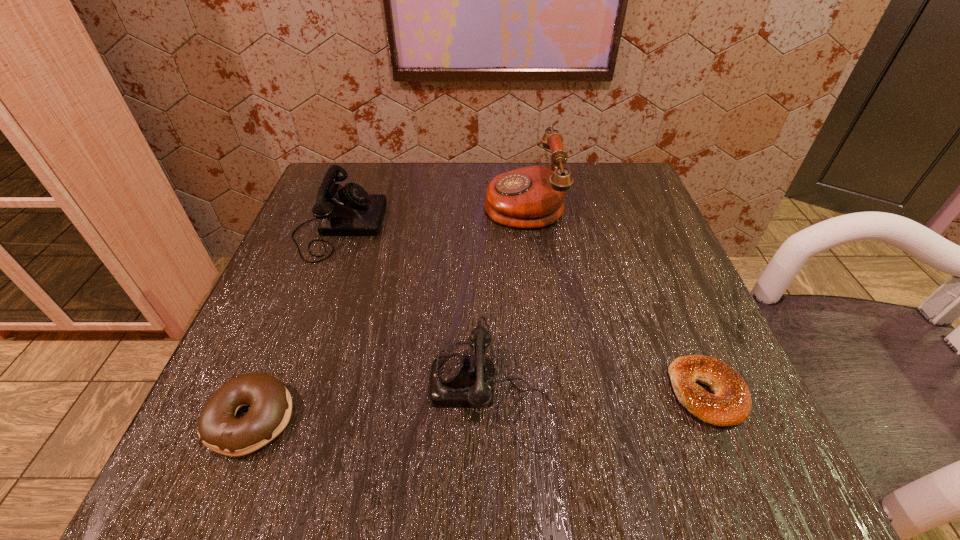
Image resolution: width=960 pixels, height=540 pixels. I want to click on free space that satisfies the following two spatial constraints: 1. on the back side of the rightmost object; 2. on the front face of the fourth shortest object, so click(x=637, y=226).

What are the coordinates of `vacant point that satisfies the following two spatial constraints: 1. on the front-facing side of the nearest telephone; 2. on the right side of the rightmost object` in the screenshot? It's located at (492, 393).

You are a GUI agent. You are given a task and a screenshot of the screen. Output one action in this format:
    pyautogui.click(x=<x>, y=<y>)
    Task: Click on the free spot that satisfies the following two spatial constraints: 1. on the dial of the tallest telephone; 2. on the left side of the bagel
    
    Given the screenshot: What is the action you would take?
    pyautogui.click(x=546, y=393)

Identify the location of free space that satisfies the following two spatial constraints: 1. on the dial of the tallest telephone; 2. on the front side of the doughnut. pos(550,418).

Locate an element on the screen. This screenshot has width=960, height=540. free space that satisfies the following two spatial constraints: 1. on the front face of the leftmost telephone; 2. on the left side of the rightmost object is located at coordinates (276, 393).

Find the location of `vacant region that satisfies the following two spatial constraints: 1. on the front face of the fourth shortest object; 2. on the right side of the rightmost object`. vacant region that satisfies the following two spatial constraints: 1. on the front face of the fourth shortest object; 2. on the right side of the rightmost object is located at coordinates (276, 393).

Locate an element on the screen. This screenshot has width=960, height=540. free space that satisfies the following two spatial constraints: 1. on the front-facing side of the nearest telephone; 2. on the front side of the second shortest object is located at coordinates (493, 418).

Where is `vacant area in the image that satisfies the following two spatial constraints: 1. on the front-facing side of the bagel; 2. on the left side of the shortest telephone`? The image size is (960, 540). vacant area in the image that satisfies the following two spatial constraints: 1. on the front-facing side of the bagel; 2. on the left side of the shortest telephone is located at coordinates (492, 393).

Identify the location of vacant area in the image that satisfies the following two spatial constraints: 1. on the front-facing side of the nearest telephone; 2. on the front side of the fourth tallest object. (493, 418).